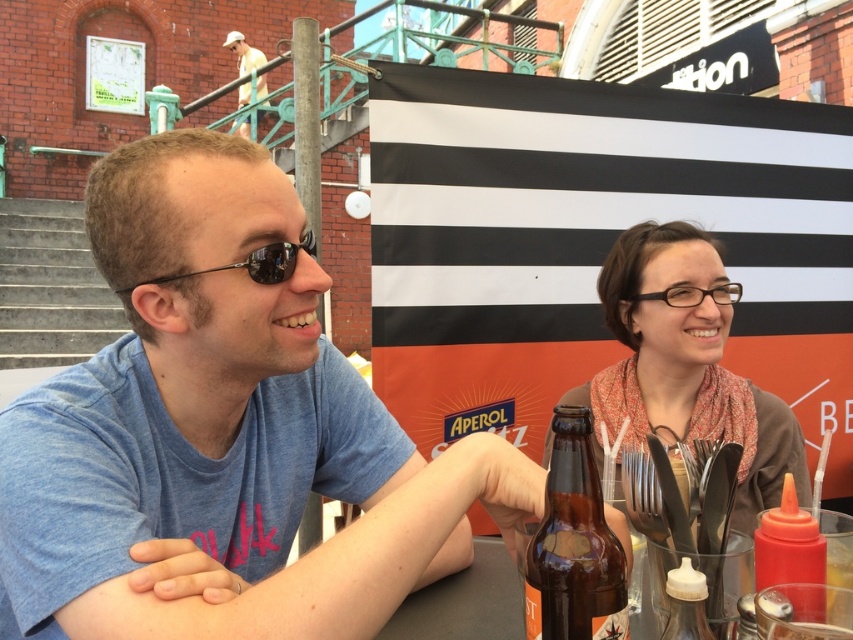
Question: Which point appears closest to the camera in this image?

Choices:
 (A) (790, 536)
 (B) (184, 314)

Answer: (A)

Question: Where is matte brown scarf at right located in relation to light yellow shirt at upper left in the image?

Choices:
 (A) above
 (B) below

Answer: (B)

Question: Which object is farther from the camera taking this photo?

Choices:
 (A) black reflective sunglasses at left
 (B) matte brown scarf at right

Answer: (B)

Question: Which object is closer to the camera taking this photo?

Choices:
 (A) blue cotton shirt at left
 (B) brown glass bottle at center

Answer: (B)

Question: Can you confirm if blue cotton shirt at left is positioned above light yellow shirt at upper left?

Choices:
 (A) no
 (B) yes

Answer: (A)

Question: Does blue cotton shirt at left appear under matte plastic ketchup bottle at lower right?

Choices:
 (A) no
 (B) yes

Answer: (A)